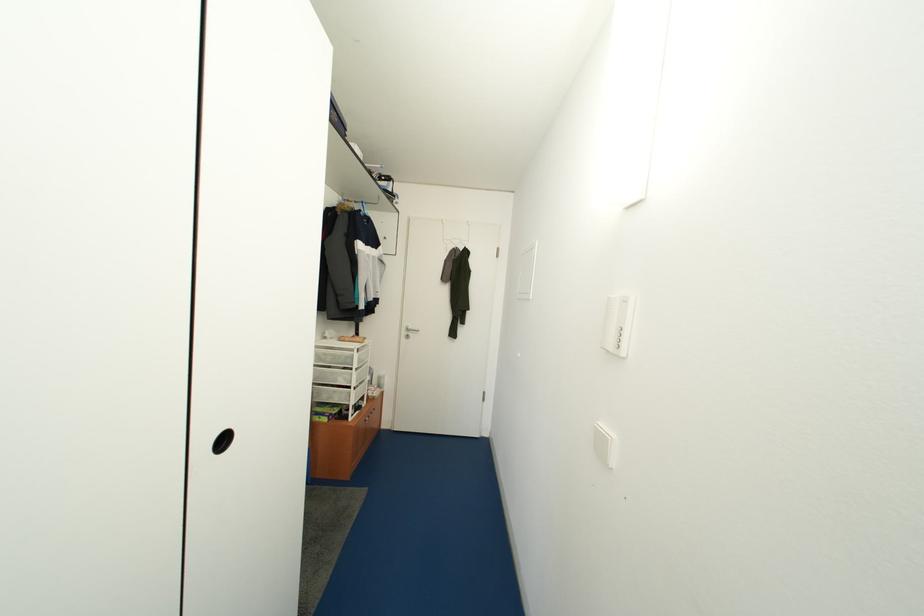
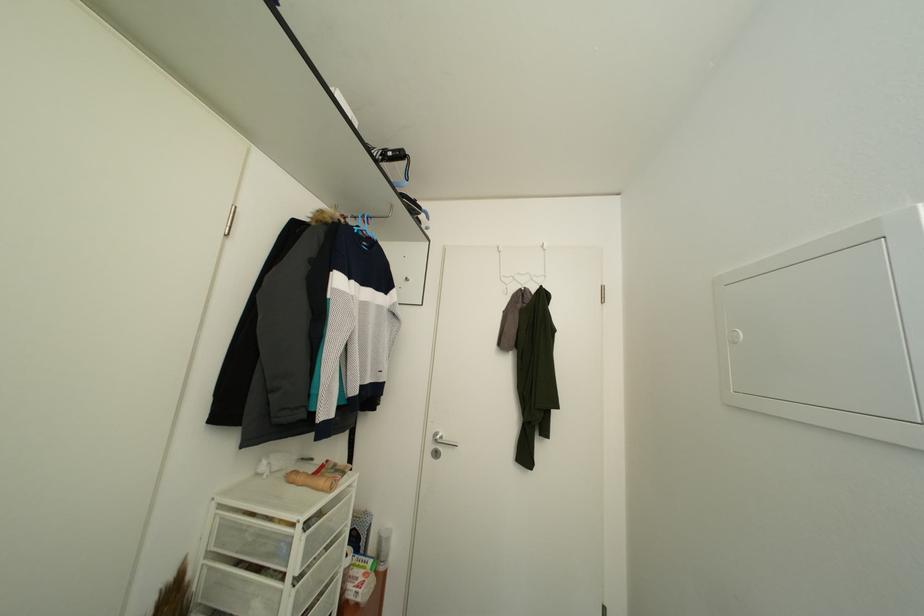
Question: What movement of the cameraman would produce the second image?

Choices:
 (A) Left
 (B) Right
 (C) Forward
 (D) Backward

Answer: (C)